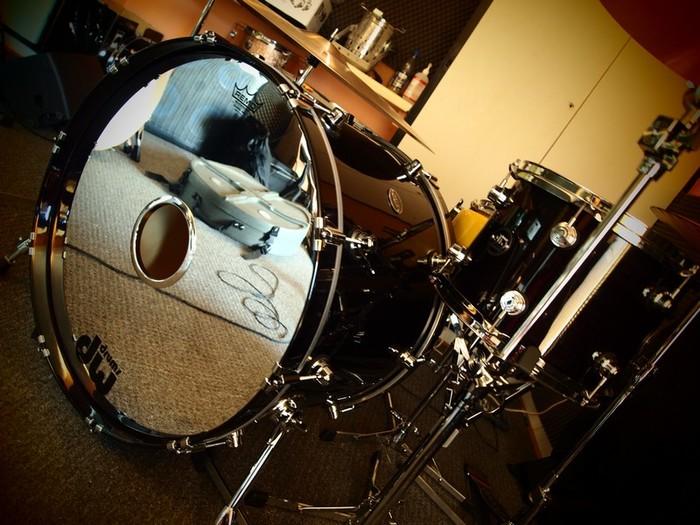
You are a GUI agent. You are given a task and a screenshot of the screen. Output one action in this format:
    pyautogui.click(x=<x>, y=<y>)
    Task: Click on the floor
    The height and width of the screenshot is (525, 700).
    Given the screenshot: What is the action you would take?
    pyautogui.click(x=129, y=516)